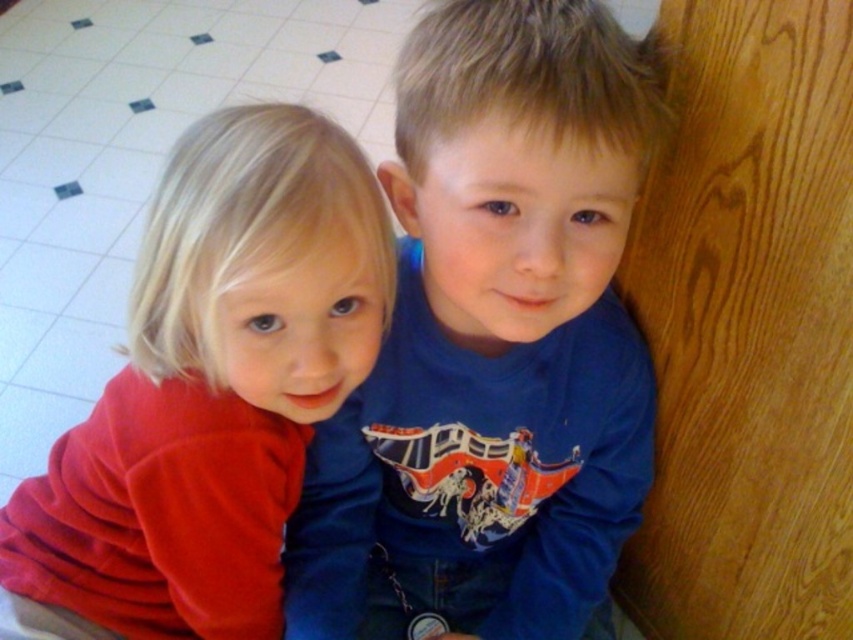
You are a photographer setting up a shoot in this room. You want to place a small prop exactly where the blue cotton shirt at center is currently located. What coordinates should you use to position the prop?

The coordinates to position the prop where the blue cotton shirt at center is located are at point [492,346].

You are a tailor measuring shirts for children. You have two shirts in front of you, the blue cotton shirt at center and the matte red shirt at left. Which shirt should you recommend for a child who needs a taller shirt?

The blue cotton shirt at center has a greater height compared to the matte red shirt at left, so it is the better choice for a child needing a taller shirt.

You are a tailor who needs to determine which shirt requires more fabric for a new order. Based on the image, which of the two shirts, the blue cotton shirt at center or the matte red shirt at left, is larger?

The blue cotton shirt at center is larger than the matte red shirt at left, so it would require more fabric for a new order.